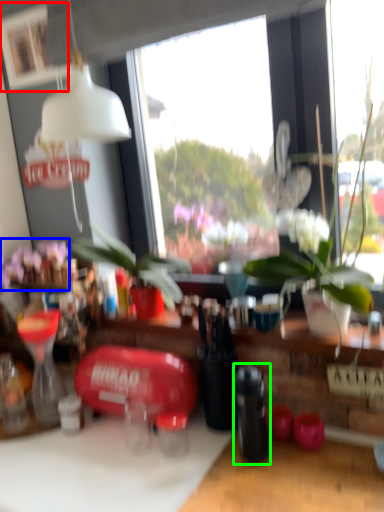
Question: Which object is positioned farthest from picture frame (highlighted by a red box)? Select from flower (highlighted by a blue box) and bottle (highlighted by a green box).

Choices:
 (A) flower
 (B) bottle

Answer: (B)